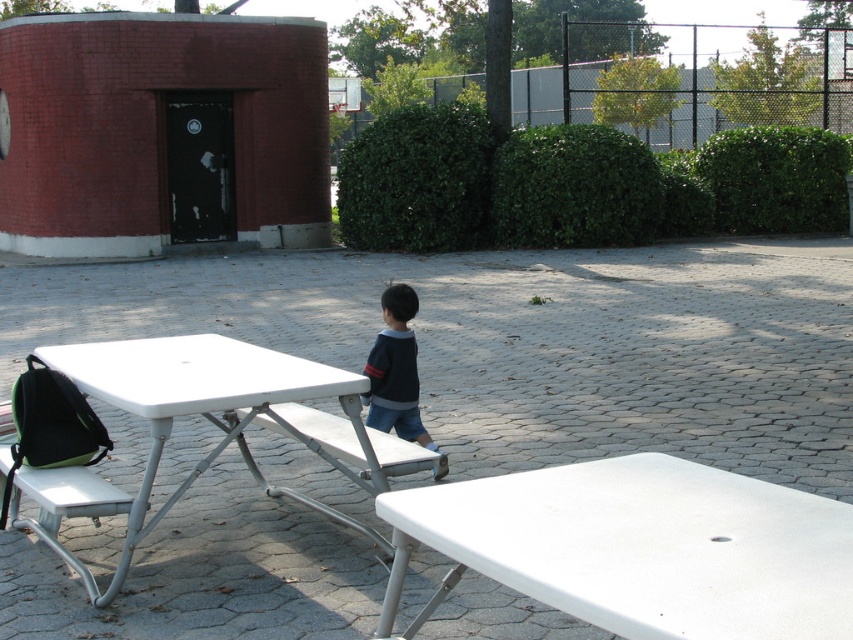
Question: Considering the real-world distances, which object is farthest from the white plastic table at lower right?

Choices:
 (A) white plastic bench at center
 (B) dark blue striped sweater at center

Answer: (B)

Question: Does white plastic table at lower left appear under white plastic bench at center?

Choices:
 (A) yes
 (B) no

Answer: (B)

Question: Is white plastic table at lower left smaller than dark blue striped sweater at center?

Choices:
 (A) no
 (B) yes

Answer: (A)

Question: Based on their relative distances, which object is nearer to the white plastic bench at center?

Choices:
 (A) dark blue striped sweater at center
 (B) white plastic table at lower right
 (C) white plastic table at lower left

Answer: (C)

Question: Which point is closer to the camera?

Choices:
 (A) dark blue striped sweater at center
 (B) white plastic bench at center
 (C) white plastic table at lower left
 (D) white plastic table at lower right

Answer: (D)

Question: Does white plastic bench at center appear under dark blue striped sweater at center?

Choices:
 (A) yes
 (B) no

Answer: (A)